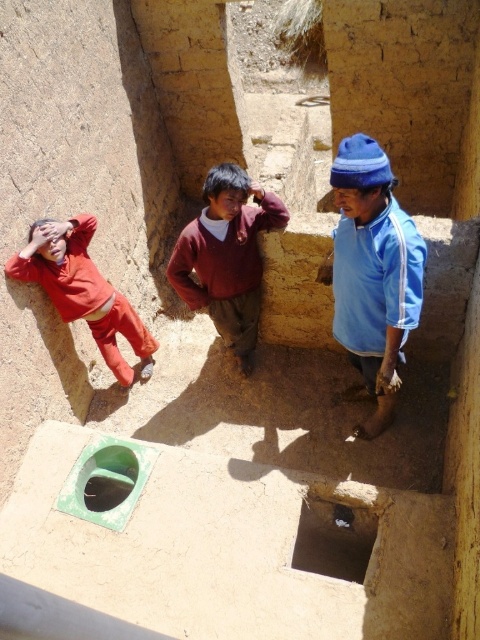
Between blue fabric shirt at right and maroon sweater at center, which one appears on the right side from the viewer's perspective?

Positioned to the right is blue fabric shirt at right.

Who is more distant from viewer, (393, 305) or (226, 317)?

The point (226, 317) is behind.

Locate an element on the screen. This screenshot has width=480, height=640. blue fabric shirt at right is located at coordinates (372, 273).

Locate an element on the screen. blue fabric shirt at right is located at coordinates (372, 273).

Is blue fabric shirt at right below matte red pants at left?

Correct, blue fabric shirt at right is located below matte red pants at left.

Is blue fabric shirt at right behind matte red pants at left?

That is False.

Is point (336, 228) behind point (108, 291)?

That is False.

You are a GUI agent. You are given a task and a screenshot of the screen. Output one action in this format:
    pyautogui.click(x=<x>, y=<y>)
    Task: Click on the blue fabric shirt at right
    The image size is (480, 640).
    Given the screenshot: What is the action you would take?
    pos(372,273)

Who is lower down, maroon sweater at center or matte red pants at left?

matte red pants at left is below.

Between point (236, 212) and point (91, 276), which one is positioned in front?

Point (236, 212) is in front.

The image size is (480, 640). Find the location of `maroon sweater at center`. maroon sweater at center is located at coordinates (227, 257).